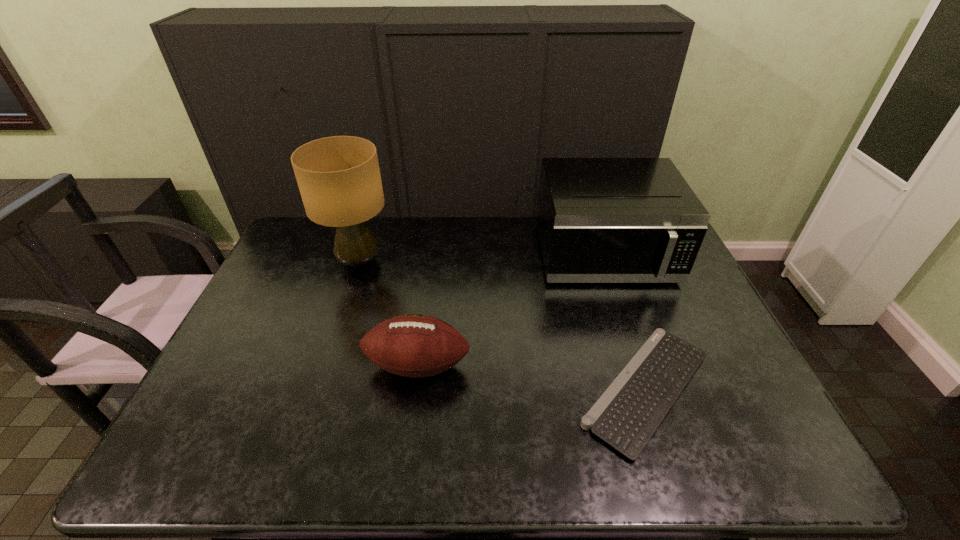
The width and height of the screenshot is (960, 540). I want to click on unoccupied area between the shortest object and the microwave_oven, so click(x=625, y=322).

Locate an element on the screen. The width and height of the screenshot is (960, 540). unoccupied area between the second shortest object and the tallest object is located at coordinates (388, 314).

This screenshot has height=540, width=960. In order to click on free space between the football (American) and the tallest object in this screenshot , I will do `click(388, 314)`.

At what (x,y) coordinates should I click in order to perform the action: click on vacant region between the microwave_oven and the shortest object. Please return your answer as a coordinate pair (x, y). This screenshot has height=540, width=960. Looking at the image, I should click on (625, 322).

This screenshot has height=540, width=960. What are the coordinates of `free space that is in between the third tallest object and the tallest object` in the screenshot? It's located at (388, 314).

This screenshot has width=960, height=540. In order to click on free point between the tallest object and the computer keyboard in this screenshot , I will do `click(502, 325)`.

The image size is (960, 540). Identify the location of free spot between the computer keyboard and the microwave_oven. (625, 322).

You are a GUI agent. You are given a task and a screenshot of the screen. Output one action in this format:
    pyautogui.click(x=<x>, y=<y>)
    Task: Click on the unoccupied position between the tallest object and the microwave_oven
    
    Given the screenshot: What is the action you would take?
    pyautogui.click(x=481, y=259)

You are a GUI agent. You are given a task and a screenshot of the screen. Output one action in this format:
    pyautogui.click(x=<x>, y=<y>)
    Task: Click on the free spot between the shortest object and the microwave_oven
    The image size is (960, 540).
    Given the screenshot: What is the action you would take?
    pyautogui.click(x=625, y=322)

The height and width of the screenshot is (540, 960). I want to click on the third closest object relative to the microwave_oven, so click(x=339, y=179).